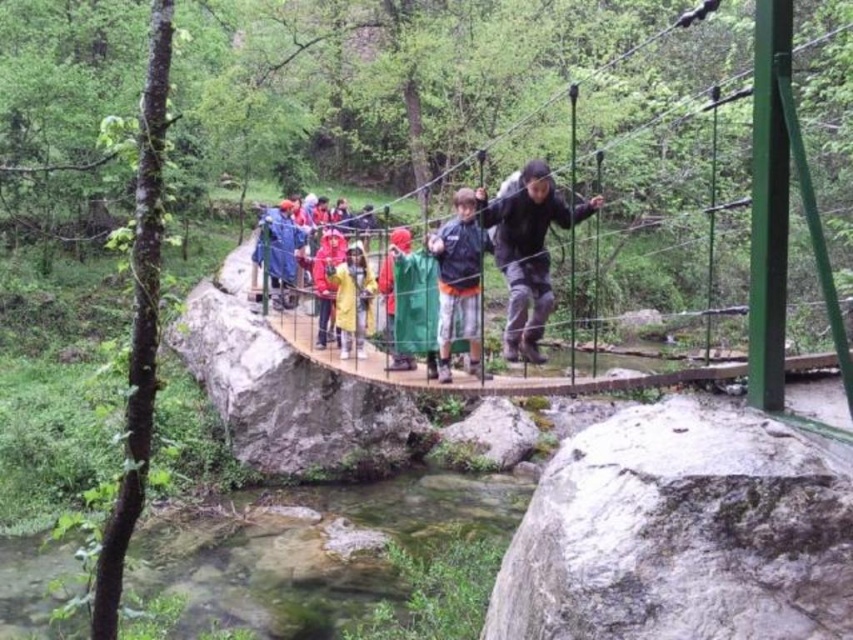
You are standing on the wooden bridge at center. If you look directly to your right, what would you see?

You would see the rugged rocks with moss and vegetation on their surfaces.

You are a hiker planning to cross the suspension bridge. You notice the clear water at lower left and the yellow waterproof jacket at center. Which object is wider from your perspective?

The clear water at lower left is wider than the yellow waterproof jacket at center.

You are standing on the suspension bridge and want to take a photo of the clear water at lower left. Where should you position yourself to capture it in the frame?

To capture the clear water at lower left, position yourself so that the camera is aimed at the coordinates approximately 0.859 on the x and 0.363 on the y axis, as this is where the clear water at lower left is located.